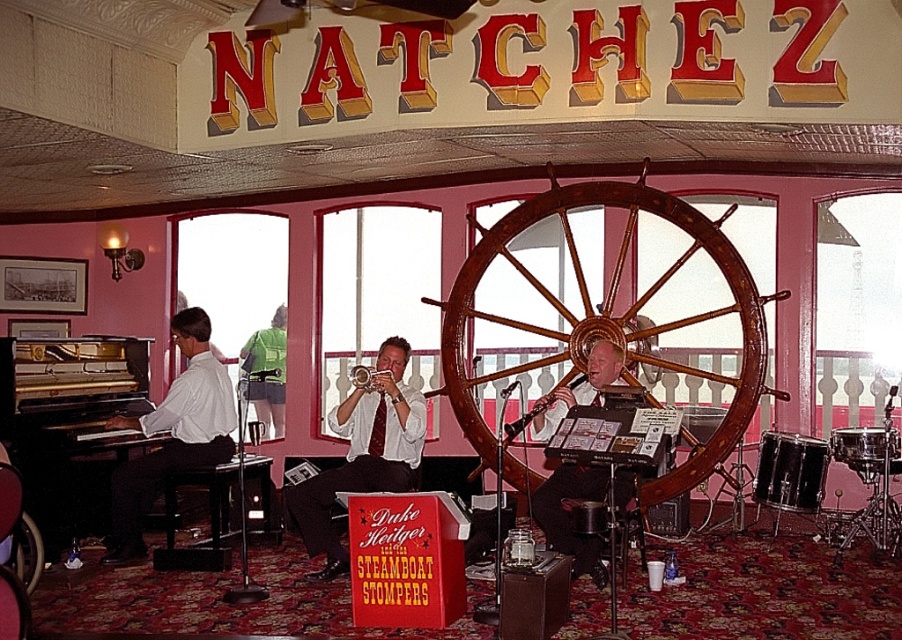
Question: Does matte white shirt at left lie behind brushed metal trumpet at center?

Choices:
 (A) yes
 (B) no

Answer: (A)

Question: Which object appears farthest from the camera in this image?

Choices:
 (A) wooden at center
 (B) gold polished piano at left
 (C) matte black saxophone at center

Answer: (A)

Question: Among these objects, which one is nearest to the camera?

Choices:
 (A) gold polished piano at left
 (B) matte white shirt at left
 (C) wooden at center

Answer: (B)

Question: Is wooden at center to the right of gold polished piano at left from the viewer's perspective?

Choices:
 (A) no
 (B) yes

Answer: (B)

Question: Among these points, which one is farthest from the camera?

Choices:
 (A) (373, 374)
 (B) (282, 333)
 (C) (558, 396)

Answer: (B)

Question: Observing the image, what is the correct spatial positioning of matte white shirt at left in reference to green fabric shirt at left?

Choices:
 (A) above
 (B) below

Answer: (B)